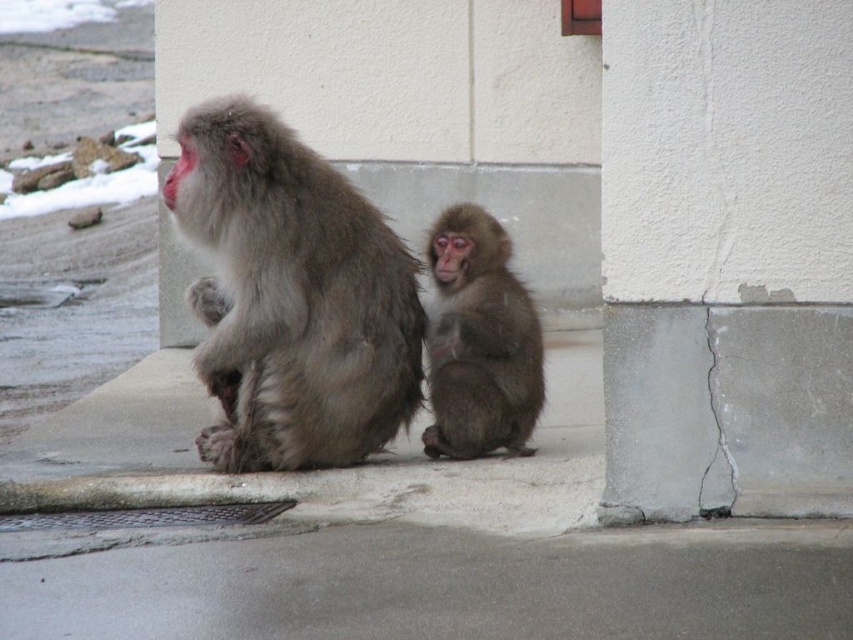
You are standing in front of the two snow monkeys. You notice two points marked in the scene. The first point is at coordinate point (257, 292) and the second is at coordinate point (523, 410). Which of these points is closer to you?

Point (257, 292) is closer to the viewer than point (523, 410).

You are a photographer trying to capture a photo of the fuzzy gray fur monkey at center. You notice a white concrete pillar at lower right might block your shot. Based on their sizes, can you determine if the pillar will completely hide the monkey from view?

The white concrete pillar at lower right is narrower than the fuzzy gray fur monkey at center, so it won

You are a photographer trying to capture a photo of the fuzzy brown monkey at center. There is a white concrete pillar at lower right in the way. Can you tell me if the pillar is bigger or smaller than the monkey?

The white concrete pillar at lower right is larger in size than the fuzzy brown monkey at center, so the pillar is bigger than the monkey.